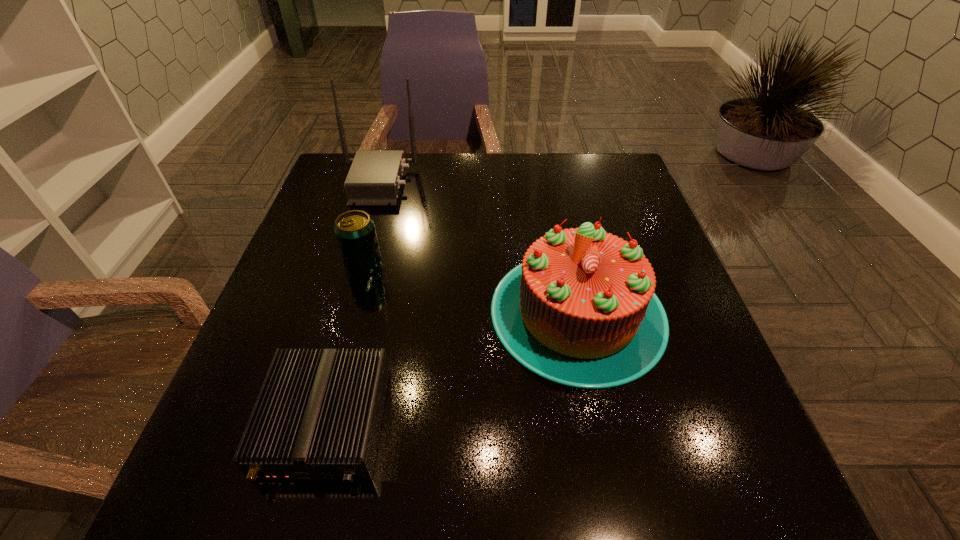
Identify which object is located as the nearest to the cake. Please provide its 2D coordinates. Your answer should be formatted as a tuple, i.e. [(x, y)], where the tuple contains the x and y coordinates of a point satisfying the conditions above.

[(318, 415)]

The width and height of the screenshot is (960, 540). I want to click on vacant space that satisfies the following two spatial constraints: 1. on the back of the taller router to connect cables; 2. on the right side of the beer can, so click(x=354, y=264).

Where is `vacant space that satisfies the following two spatial constraints: 1. on the back of the taller router to connect cables; 2. on the left side of the beer can`? Image resolution: width=960 pixels, height=540 pixels. vacant space that satisfies the following two spatial constraints: 1. on the back of the taller router to connect cables; 2. on the left side of the beer can is located at coordinates (354, 264).

Find the location of a particular element. Image resolution: width=960 pixels, height=540 pixels. free spot that satisfies the following two spatial constraints: 1. on the front side of the third tallest object; 2. on the left side of the rightmost object is located at coordinates click(350, 312).

I want to click on vacant space that satisfies the following two spatial constraints: 1. on the back side of the beer can; 2. on the back of the tallest object to connect cables, so click(386, 183).

Locate an element on the screen. free location that satisfies the following two spatial constraints: 1. on the back of the farthest object to connect cables; 2. on the left side of the cake is located at coordinates (340, 312).